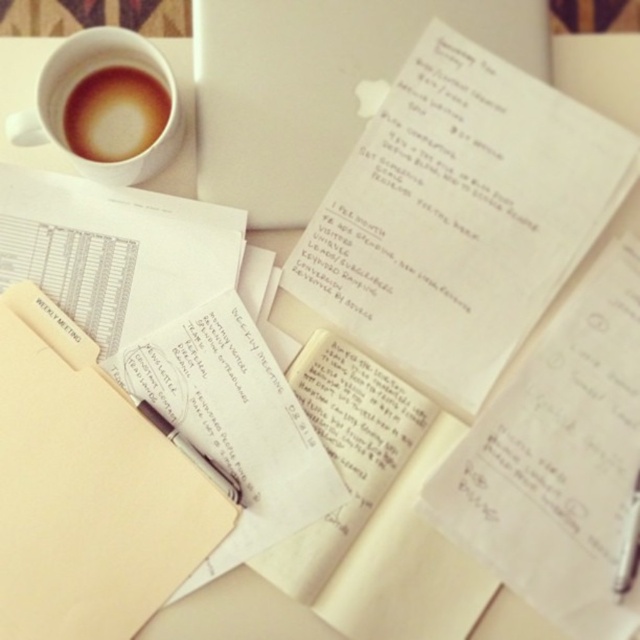
From the picture: Does white paper at center have a greater width compared to black glossy pen at center?

Indeed, white paper at center has a greater width compared to black glossy pen at center.

Can you confirm if white paper at center is shorter than black glossy pen at center?

Incorrect, white paper at center's height does not fall short of black glossy pen at center's.

Does point (570, 198) lie behind point (138, 404)?

Yes, it is.

I want to click on white paper at center, so click(458, 218).

Does white paper at center appear on the left side of brown frothy coffee at upper left?

In fact, white paper at center is to the right of brown frothy coffee at upper left.

Does point (506, 307) come behind point (125, 152)?

No, it is not.

Which is in front, point (512, 109) or point (147, 129)?

Point (512, 109)

Where is `white paper at center`? white paper at center is located at coordinates (458, 218).

Based on the photo, which is above, white paper at upper center or brown frothy coffee at upper left?

white paper at upper center is higher up.

Is point (352, 72) farther from camera compared to point (131, 124)?

Yes, point (352, 72) is farther from viewer.

Does point (241, 20) come in front of point (70, 131)?

No.

The width and height of the screenshot is (640, 640). Identify the location of white paper at upper center. (316, 84).